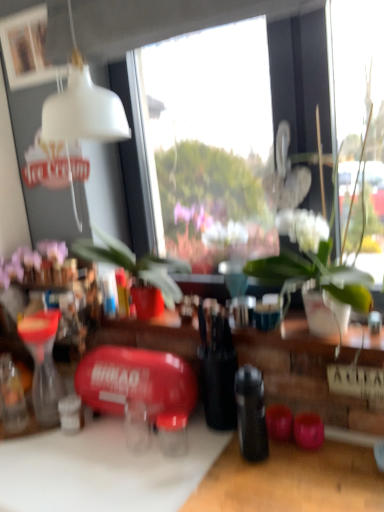
The image size is (384, 512). I want to click on free point to the left of black matte bottle at center, so click(x=192, y=469).